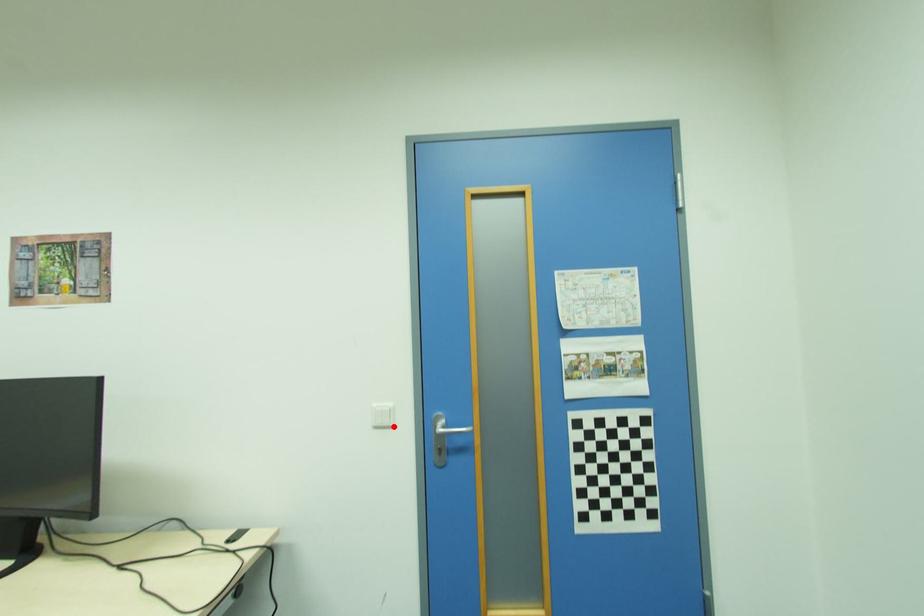
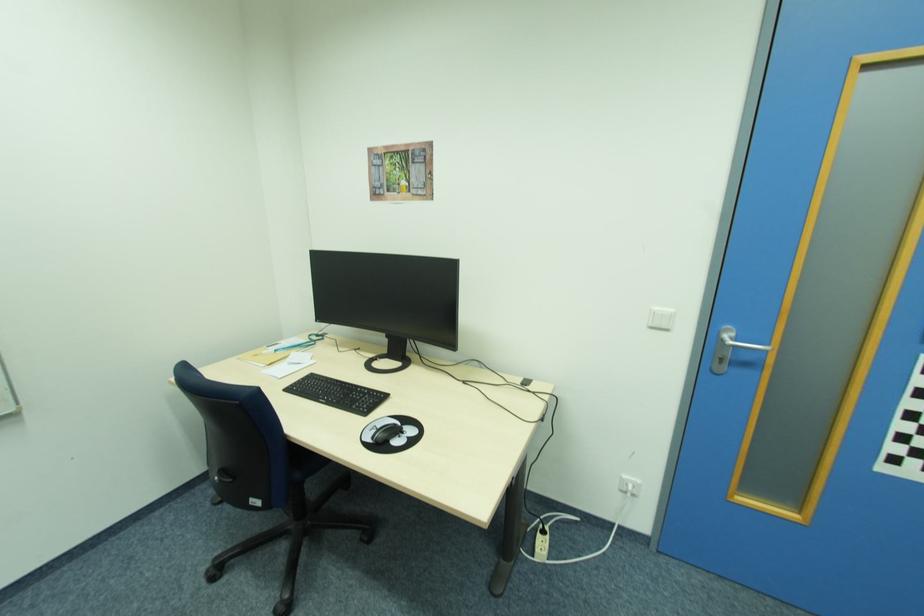
In the second image, find the point that corresponds to the highlighted location in the first image.

(670, 329)